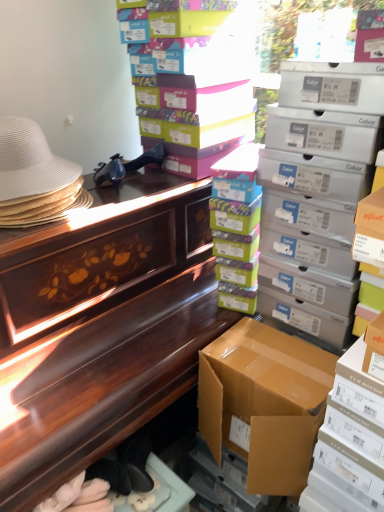
The width and height of the screenshot is (384, 512). Identify the location of vacant area on top of multicolored cardboard boxes at center, acting as the 3th box starting from the bottom (from a real-world perspective). (243, 161).